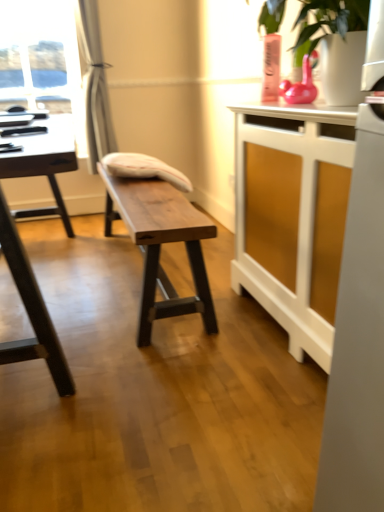
Question: In the image, is white wood cabinet at right, the 1th table positioned from the right, on the left side or the right side of silky white curtain at left?

Choices:
 (A) left
 (B) right

Answer: (B)

Question: Is white wood cabinet at right, the 3th table from the left, in front of or behind silky white curtain at left in the image?

Choices:
 (A) front
 (B) behind

Answer: (A)

Question: Based on their relative distances, which object is nearer to the silky white curtain at left?

Choices:
 (A) white fabric cushion at center
 (B) black glossy table at left, the 3th table from the right
 (C) natural wood bench at center, the 2th table in the right-to-left sequence
 (D) white wood cabinet at right, the 1th table positioned from the right

Answer: (A)

Question: Estimate the real-world distances between objects in this image. Which object is farther from the black glossy table at left, the 3th table from the right?

Choices:
 (A) natural wood bench at center, which is the 2th table in left-to-right order
 (B) white fabric cushion at center
 (C) silky white curtain at left
 (D) white wood cabinet at right, the 3th table from the left

Answer: (C)